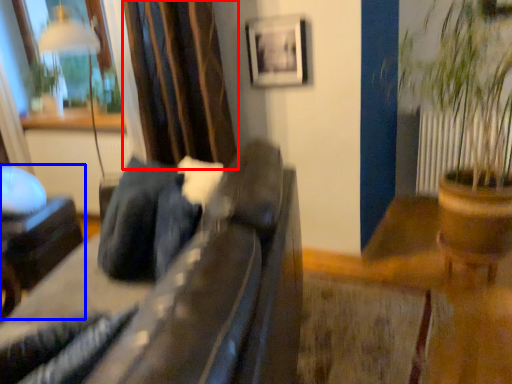
Question: Among these objects, which one is nearest to the camera, curtain (highlighted by a red box) or furniture (highlighted by a blue box)?

Choices:
 (A) curtain
 (B) furniture

Answer: (A)